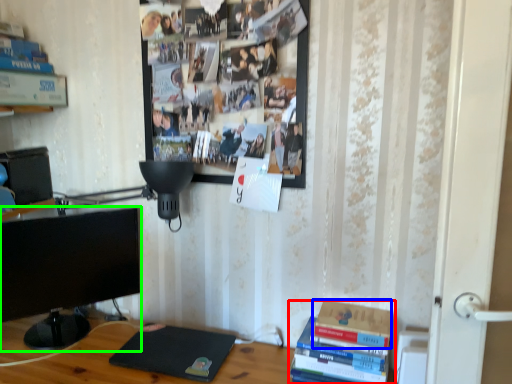
Question: Which object is positioned closest to book (highlighted by a red box)? Select from paperback book (highlighted by a blue box) and television (highlighted by a green box).

Choices:
 (A) paperback book
 (B) television

Answer: (A)